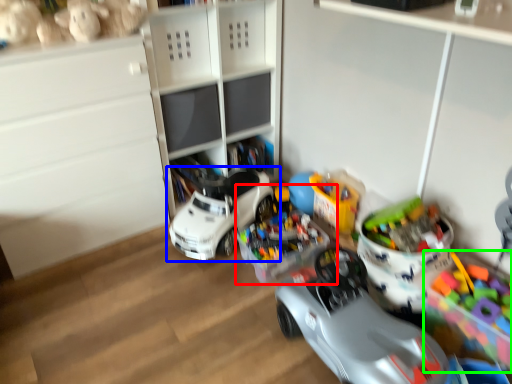
Question: Which is nearer to the toy (highlighted by a red box)? toy (highlighted by a blue box) or toy (highlighted by a green box).

Choices:
 (A) toy
 (B) toy

Answer: (A)